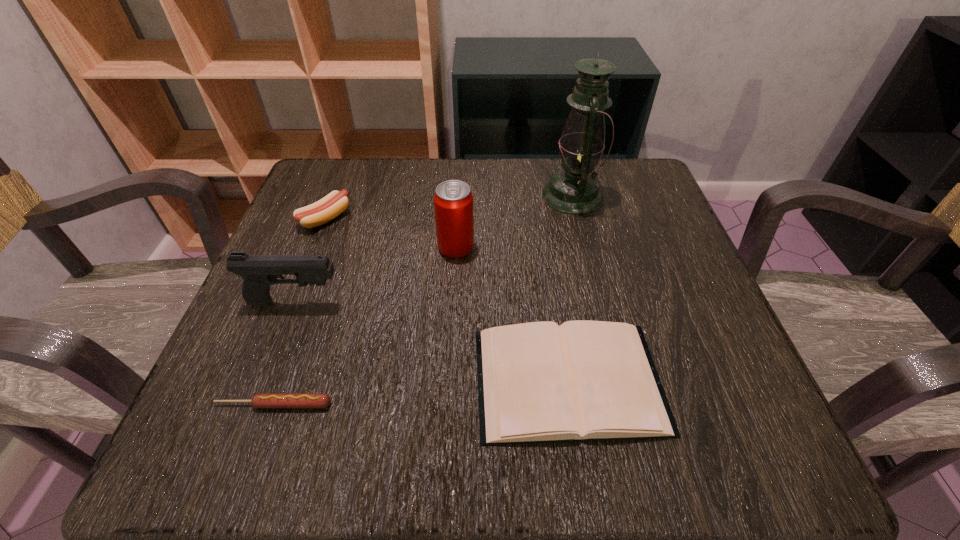
In order to click on pistol at the left edge in this screenshot , I will do `click(259, 272)`.

You are a GUI agent. You are given a task and a screenshot of the screen. Output one action in this format:
    pyautogui.click(x=<x>, y=<y>)
    Task: Click on the oil lamp located at the right edge
    The width and height of the screenshot is (960, 540).
    Given the screenshot: What is the action you would take?
    point(575,189)

Locate an element on the screen. The height and width of the screenshot is (540, 960). hardback book at the right edge is located at coordinates (538, 382).

Locate an element on the screen. This screenshot has width=960, height=540. object situated at the far left corner is located at coordinates (332, 205).

Locate an element on the screen. object that is positioned at the near left corner is located at coordinates (262, 400).

Identify the location of object located at the far right corner. (575, 189).

Locate an element on the screen. The width and height of the screenshot is (960, 540). object present at the near right corner is located at coordinates (538, 382).

In order to click on vacant space at the far edge of the desktop in this screenshot , I will do `click(538, 160)`.

Locate an element on the screen. free spot at the near edge of the desktop is located at coordinates (462, 408).

Identify the location of vacant space at the left edge. (244, 373).